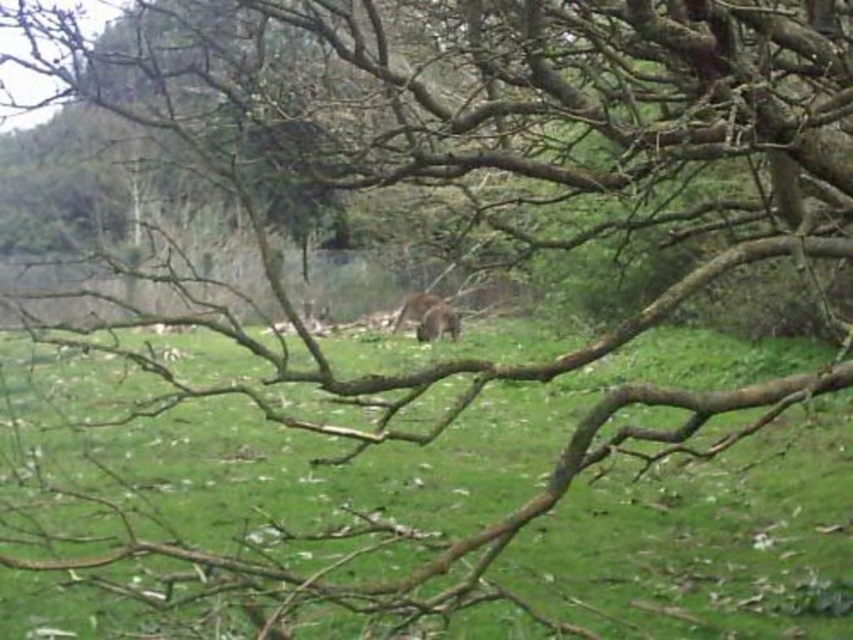
You are a photographer trying to capture a wide shot of the green grassy field at center and the brown furry animal at center. Based on the scene, which one would appear narrower in your photo?

The green grassy field at center appears narrower than the brown furry animal at center in the photo because its width is less than the animal.

You are standing at the origin point in the image and want to walk to the green grassy field at center. According to the coordinates provided, in which direction should you move?

The green grassy field at center is located at point 0.789 on the x and 0.499 on the y axis. Since you are at the origin, you should move towards the right and slightly forward to reach it.

You are a photographer aiming to capture a clear shot of the brown furry animal at center without the green grassy field at center in the background. Based on their positions, is this possible?

The green grassy field at center is positioned under the brown furry animal at center, so the animal is above the field. Therefore, you can adjust your angle to focus on the animal while excluding the field from the background.